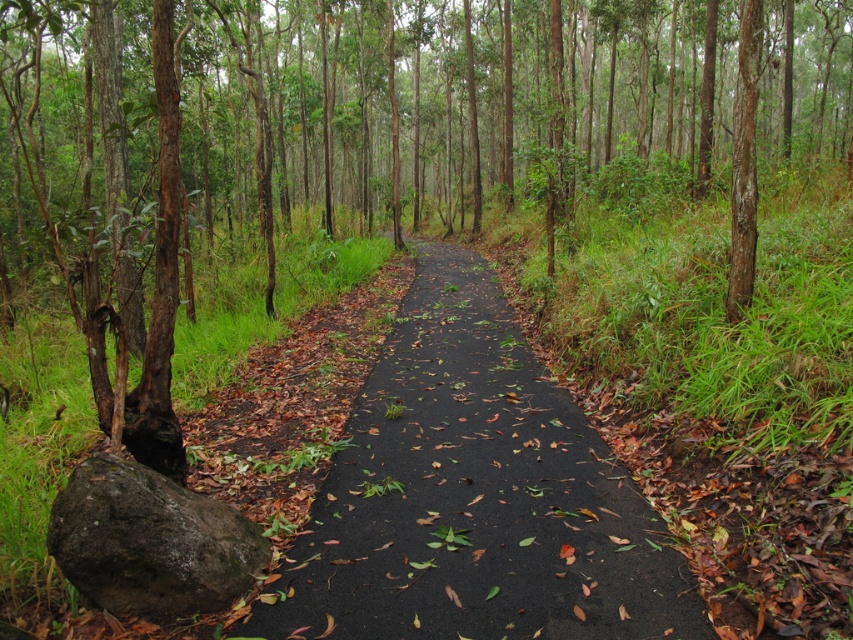
You are a hiker carrying a backpack and need to cross the black asphalt path at center to reach the green mossy rock at lower left. What is the shortest distance you must travel to get from the path to the rock?

The shortest distance you must travel to get from the black asphalt path at center to the green mossy rock at lower left is 1.64 meters.

You are a hiker walking along the black asphalt path at center and want to reach the green mossy rock at lower left. Which direction should you walk to get closer to the rock?

The black asphalt path at center is in front of green mossy rock at lower left, so you should walk towards the lower left direction to reach the rock.